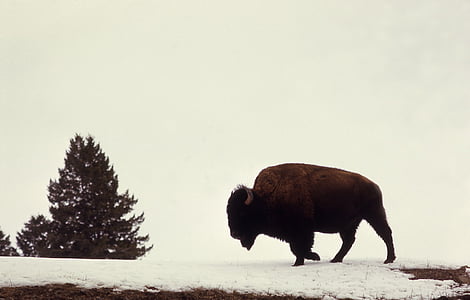
Where is `floor`? The width and height of the screenshot is (470, 300). floor is located at coordinates (62, 296), (443, 274).